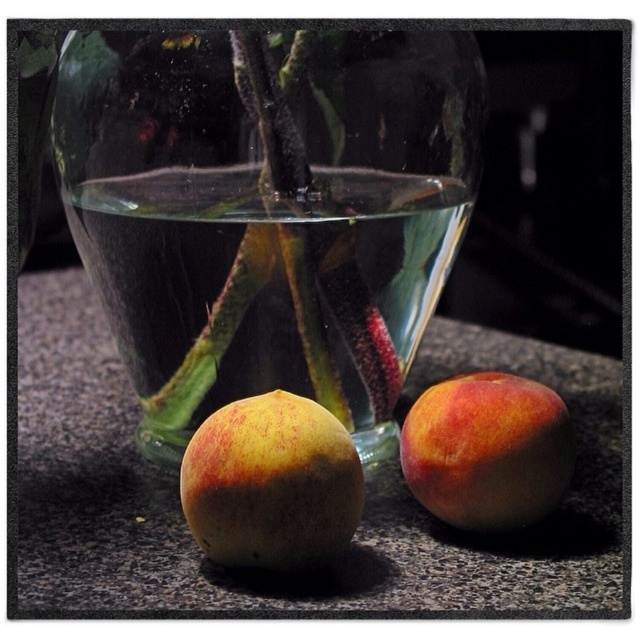
Question: In this image, where is ripe yellow peach at center located relative to ripe peach at center?

Choices:
 (A) right
 (B) left

Answer: (B)

Question: Estimate the real-world distances between objects in this image. Which object is farther from the smooth granite surface at center?

Choices:
 (A) ripe peach at center
 (B) ripe yellow peach at center
 (C) transparent glass vase at center

Answer: (A)

Question: Based on their relative distances, which object is farther from the transparent glass vase at center?

Choices:
 (A) ripe peach at center
 (B) ripe yellow peach at center
 (C) smooth granite surface at center

Answer: (A)

Question: Does transparent glass vase at center appear over smooth granite surface at center?

Choices:
 (A) no
 (B) yes

Answer: (B)

Question: Which point is farther to the camera?

Choices:
 (A) transparent glass vase at center
 (B) ripe peach at center

Answer: (A)

Question: Is ripe yellow peach at center to the left of ripe peach at center from the viewer's perspective?

Choices:
 (A) no
 (B) yes

Answer: (B)